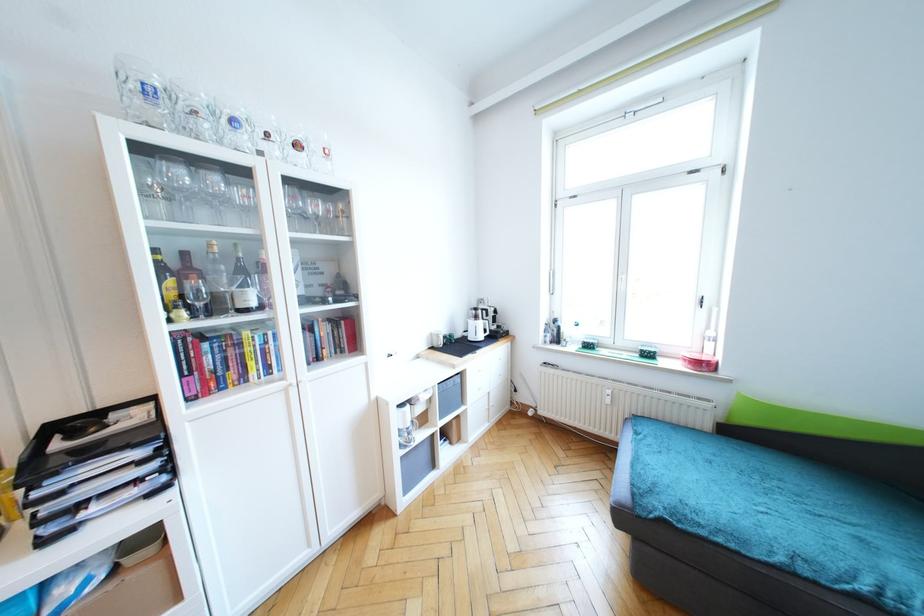
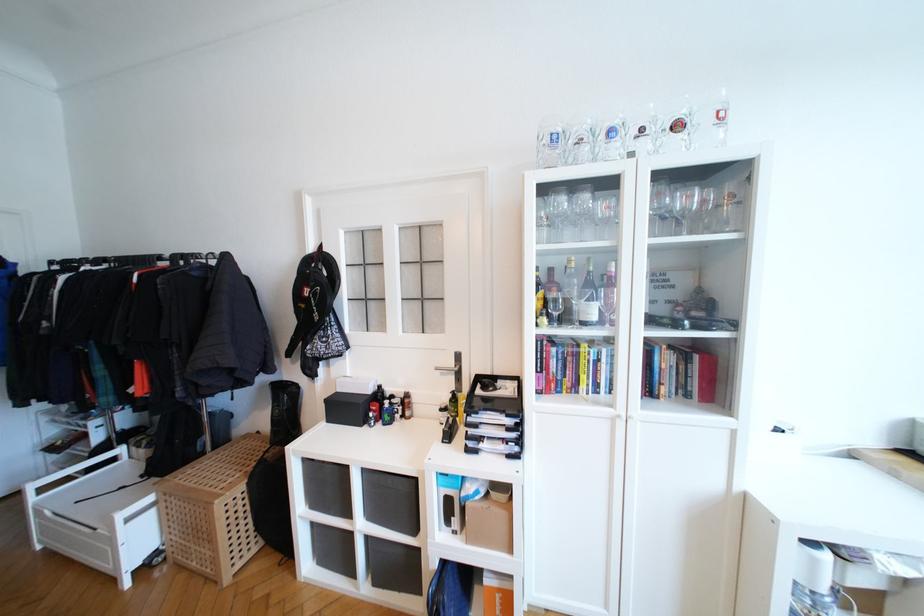
Where in the second image is the point corresponding to [241,260] from the first image?

(591, 273)